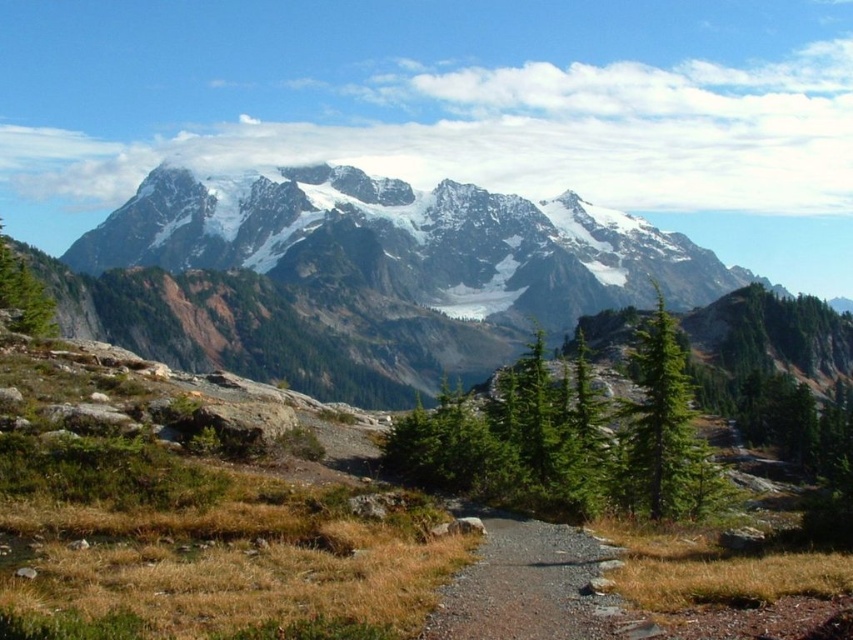
Question: Which object is positioned farthest from the snowy granite mountain range at center?

Choices:
 (A) green textured tree at center-right
 (B) gravel path at center

Answer: (B)

Question: Considering the relative positions of snowy granite mountain range at center and gravel path at center in the image provided, where is snowy granite mountain range at center located with respect to gravel path at center?

Choices:
 (A) right
 (B) left

Answer: (B)

Question: Which of the following is the closest to the observer?

Choices:
 (A) (711, 308)
 (B) (573, 624)

Answer: (B)

Question: Which object is farther from the camera taking this photo?

Choices:
 (A) snowy granite mountain range at center
 (B) green textured tree at center-right

Answer: (A)

Question: Is snowy granite mountain range at center thinner than gravel path at center?

Choices:
 (A) yes
 (B) no

Answer: (B)

Question: Is snowy granite mountain range at center thinner than gravel path at center?

Choices:
 (A) yes
 (B) no

Answer: (B)